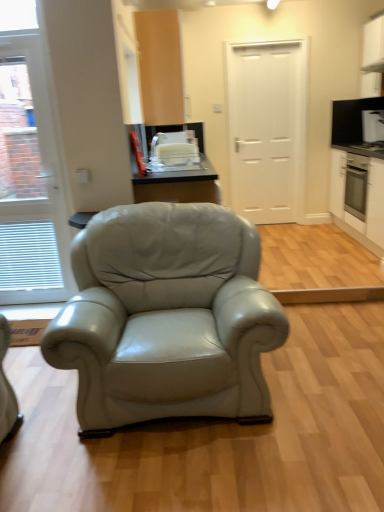
Question: Does white glossy microwave at upper right, arranged as the 2th appliance when ordered from the bottom, come in front of white matte door at center, acting as the second door starting from the front?

Choices:
 (A) yes
 (B) no

Answer: (B)

Question: From a real-world perspective, is white glossy microwave at upper right, the 1th appliance when ordered from right to left, on white matte door at center, positioned as the 2th door in left-to-right order?

Choices:
 (A) yes
 (B) no

Answer: (A)

Question: From a real-world perspective, does white glossy microwave at upper right, the 1th appliance when ordered from right to left, sit lower than white matte door at center, which is counted as the 1th door, starting from the back?

Choices:
 (A) no
 (B) yes

Answer: (A)

Question: Does white glossy microwave at upper right, the 1th appliance when ordered from right to left, have a smaller size compared to white matte door at center, which is counted as the first door, starting from the right?

Choices:
 (A) yes
 (B) no

Answer: (A)

Question: Would you say white glossy microwave at upper right, the 1th appliance when ordered from right to left, contains white matte door at center, positioned as the 2th door in left-to-right order?

Choices:
 (A) no
 (B) yes

Answer: (A)

Question: Is white glossy door at left, placed as the first door when sorted from front to back, taller or shorter than white matte cabinet at right, placed as the 2th cabinetry when sorted from right to left?

Choices:
 (A) tall
 (B) short

Answer: (A)

Question: Would you say white glossy door at left, placed as the first door when sorted from front to back, is inside or outside white matte cabinet at right, placed as the 2th cabinetry when sorted from right to left?

Choices:
 (A) outside
 (B) inside

Answer: (A)

Question: From a real-world perspective, is white glossy door at left, marked as the 2th door in a back-to-front arrangement, physically located above or below white matte cabinet at right, placed as the 2th cabinetry when sorted from right to left?

Choices:
 (A) above
 (B) below

Answer: (A)

Question: Visually, is white glossy door at left, the 2th door viewed from the right, positioned to the left or to the right of white matte cabinet at right, placed as the 2th cabinetry when sorted from right to left?

Choices:
 (A) left
 (B) right

Answer: (A)

Question: Based on their positions, is white glossy microwave at upper right, arranged as the 2th appliance when ordered from the bottom, located to the left or right of matte wood cabinet at upper center, which is counted as the first cabinetry, starting from the left?

Choices:
 (A) right
 (B) left

Answer: (A)

Question: Considering the positions of white glossy microwave at upper right, arranged as the 2th appliance when ordered from the bottom, and matte wood cabinet at upper center, which is the 3th cabinetry in right-to-left order, in the image, is white glossy microwave at upper right, arranged as the 2th appliance when ordered from the bottom, wider or thinner than matte wood cabinet at upper center, which is the 3th cabinetry in right-to-left order,?

Choices:
 (A) wide
 (B) thin

Answer: (B)

Question: From a real-world perspective, is white glossy microwave at upper right, the 2th appliance in the left-to-right sequence, positioned above or below matte wood cabinet at upper center, which is counted as the first cabinetry, starting from the left?

Choices:
 (A) below
 (B) above

Answer: (A)

Question: Is white glossy microwave at upper right, arranged as the 2th appliance when ordered from the bottom, in front of or behind matte wood cabinet at upper center, which is the 3th cabinetry in right-to-left order, in the image?

Choices:
 (A) behind
 (B) front

Answer: (A)

Question: Looking at their shapes, would you say white glossy toaster at upper center, which is the second appliance in right-to-left order, is wider or thinner than white glossy microwave at upper right, the 1th appliance when ordered from right to left?

Choices:
 (A) wide
 (B) thin

Answer: (A)

Question: Considering their positions, is white glossy toaster at upper center, which ranks as the 1th appliance in front-to-back order, located in front of or behind white glossy microwave at upper right, which ranks as the first appliance in top-to-bottom order?

Choices:
 (A) front
 (B) behind

Answer: (A)